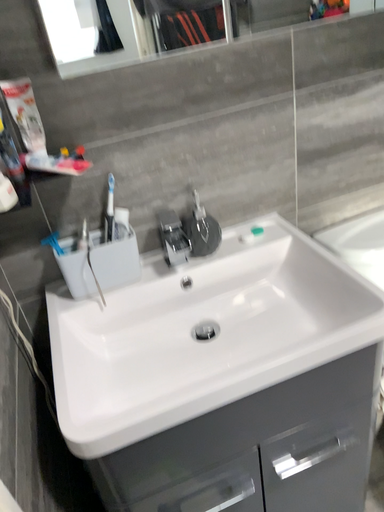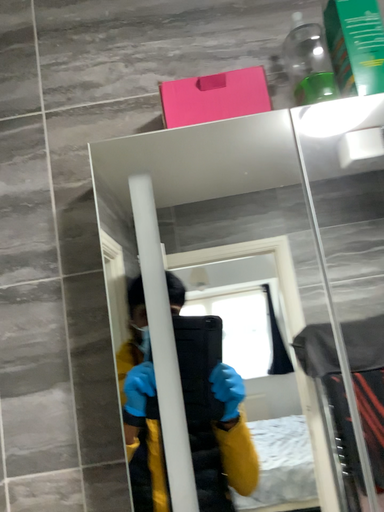
Question: Which way did the camera rotate in the video?

Choices:
 (A) rotated right
 (B) rotated left

Answer: (B)